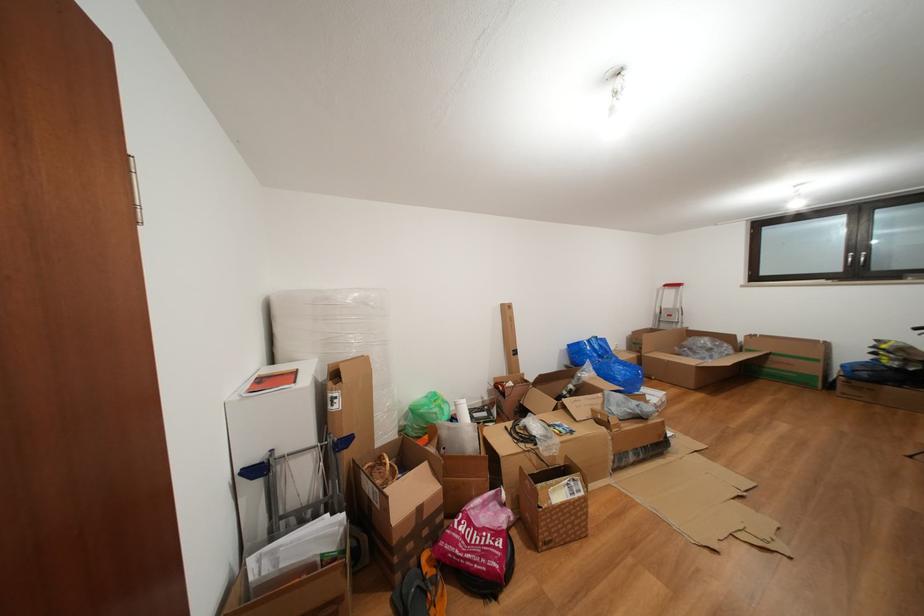
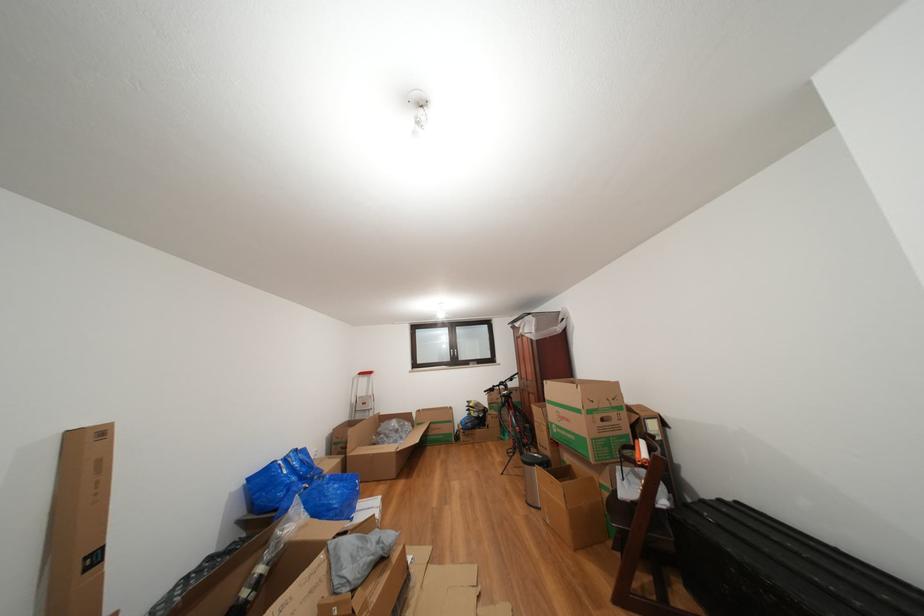
First-person continuous shooting, in which direction is the camera rotating?

The rotation direction of the camera is right-up.